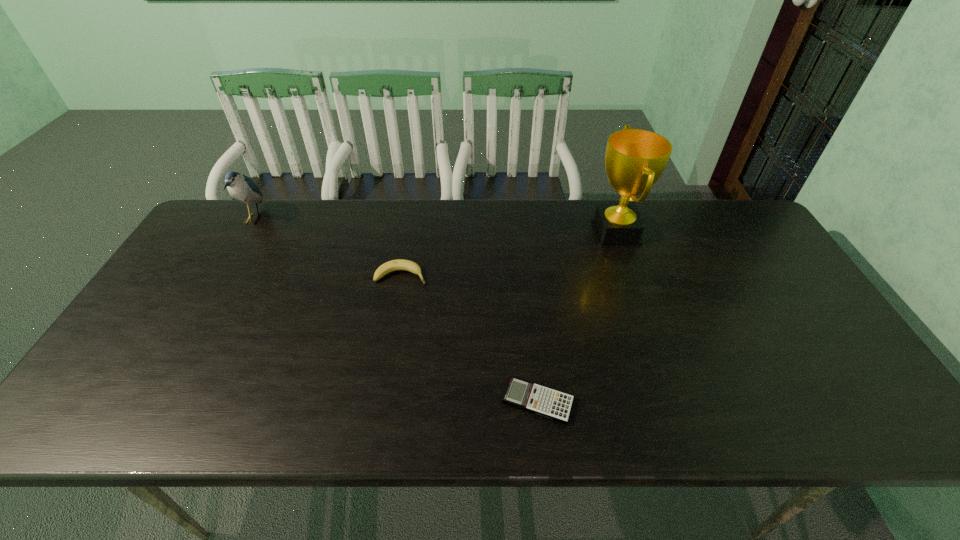
The image size is (960, 540). In order to click on free space between the leftmost object and the award in this screenshot , I will do `click(435, 225)`.

Where is `free spot between the third tallest object and the shortest object`? The image size is (960, 540). free spot between the third tallest object and the shortest object is located at coordinates (469, 338).

Find the location of a particular element. The height and width of the screenshot is (540, 960). vacant area between the third object from left to right and the leftmost object is located at coordinates (396, 310).

Locate an element on the screen. free space between the third tallest object and the calculator is located at coordinates (469, 338).

You are a GUI agent. You are given a task and a screenshot of the screen. Output one action in this format:
    pyautogui.click(x=<x>, y=<y>)
    Task: Click on the third closest object to the tallest object
    The height and width of the screenshot is (540, 960).
    Given the screenshot: What is the action you would take?
    pyautogui.click(x=242, y=188)

At what (x,y) coordinates should I click in order to perform the action: click on object that is the second closest to the rightmost object. Please return your answer as a coordinate pair (x, y). The image size is (960, 540). Looking at the image, I should click on (400, 264).

Identify the location of vacant space that satisfies the following two spatial constraints: 1. at the tip of the leftmost object's beak; 2. on the left side of the calculator. The height and width of the screenshot is (540, 960). (146, 401).

At what (x,y) coordinates should I click in order to perform the action: click on free spot that satisfies the following two spatial constraints: 1. at the tip of the calculator's beak; 2. on the right side of the bird. Please return your answer as a coordinate pair (x, y). Image resolution: width=960 pixels, height=540 pixels. Looking at the image, I should click on (146, 401).